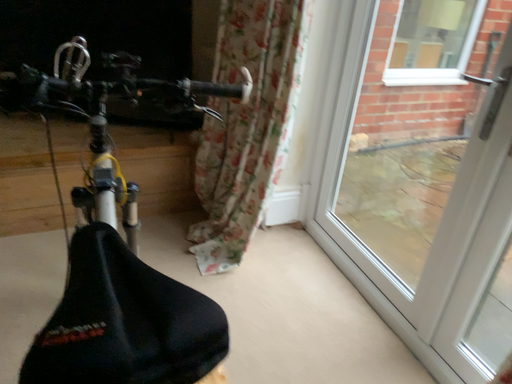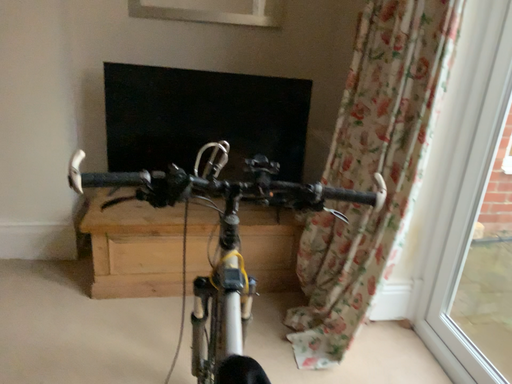
Question: Which way did the camera rotate in the video?

Choices:
 (A) rotated right
 (B) rotated left

Answer: (B)